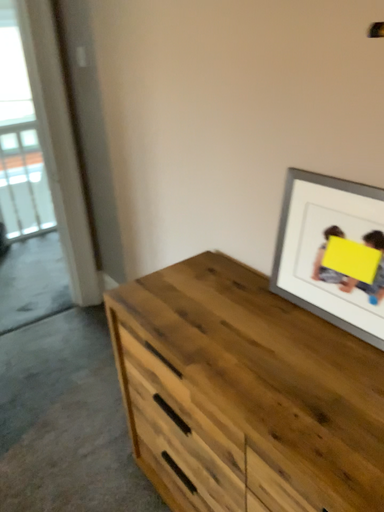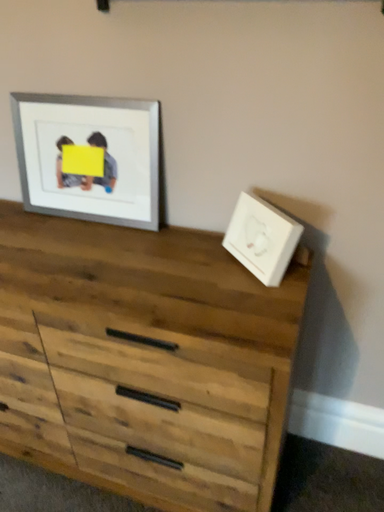
Question: Which way did the camera rotate in the video?

Choices:
 (A) rotated right
 (B) rotated left

Answer: (A)